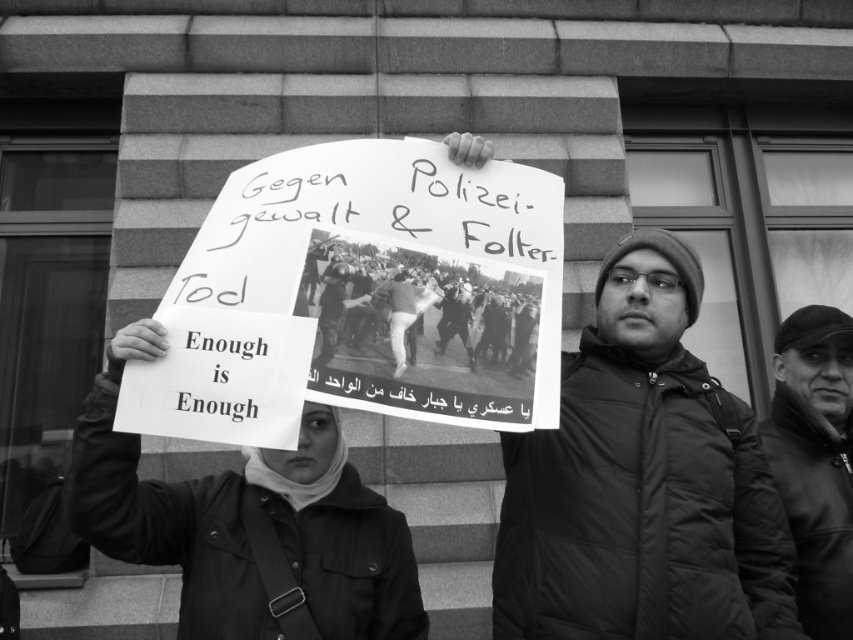
Is matte black jacket at center closer to camera compared to dark fabric jacket at center?

Yes, it is.

Describe the element at coordinates (642, 483) in the screenshot. I see `matte black jacket at center` at that location.

Who is more forward, [558,604] or [807,477]?

Point [558,604] is more forward.

You are a GUI agent. You are given a task and a screenshot of the screen. Output one action in this format:
    pyautogui.click(x=<x>, y=<y>)
    Task: Click on the matte black jacket at center
    The width and height of the screenshot is (853, 640).
    Given the screenshot: What is the action you would take?
    pyautogui.click(x=642, y=483)